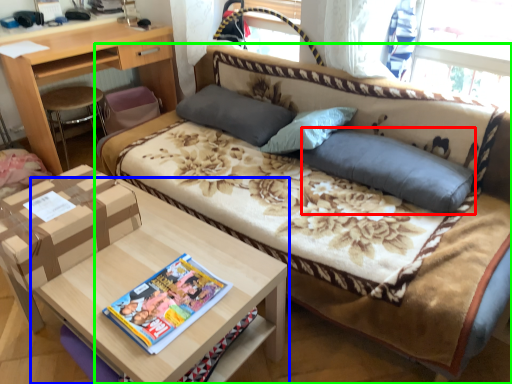
Question: Based on their relative distances, which object is nearer to pillow (highlighted by a red box)? Choose from table (highlighted by a blue box) and studio couch (highlighted by a green box).

Choices:
 (A) table
 (B) studio couch

Answer: (B)